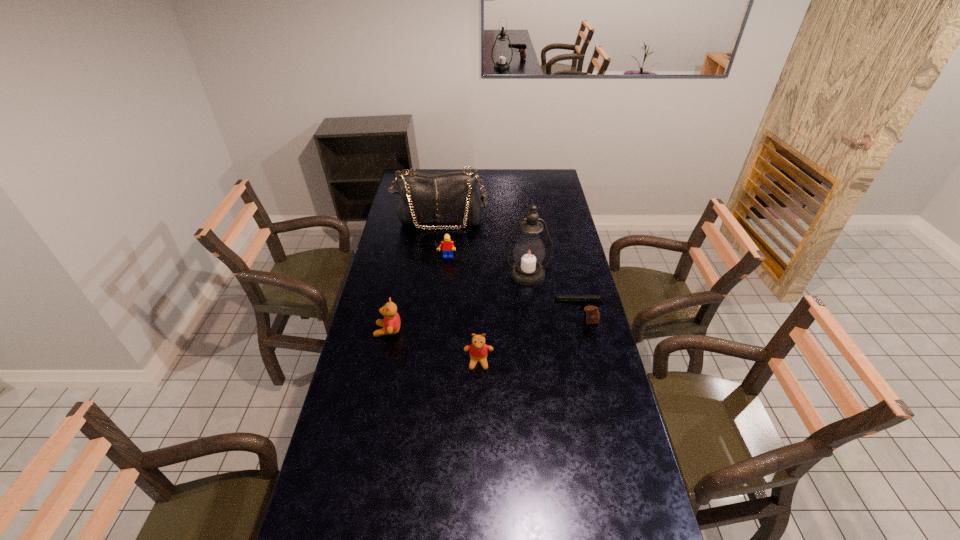
This screenshot has height=540, width=960. I want to click on pistol situated at the right edge, so click(x=590, y=303).

This screenshot has height=540, width=960. What are the coordinates of `blank space at the far edge of the desktop` in the screenshot? It's located at (450, 171).

Locate an element on the screen. This screenshot has width=960, height=540. vacant space at the left edge of the desktop is located at coordinates pyautogui.click(x=344, y=467).

Where is `vacant space at the right edge of the desktop`? The image size is (960, 540). vacant space at the right edge of the desktop is located at coordinates (561, 232).

This screenshot has width=960, height=540. In the image, there is a desktop. In order to click on free space at the near right corner in this screenshot , I will do `click(604, 534)`.

Find the location of a particular element. This screenshot has width=960, height=540. vacant area between the oil lamp and the pistol is located at coordinates (551, 298).

Where is `empty space that is in between the handbag and the fifth nearest object`? Image resolution: width=960 pixels, height=540 pixels. empty space that is in between the handbag and the fifth nearest object is located at coordinates (444, 239).

Locate an element on the screen. This screenshot has height=540, width=960. vacant space that's between the farther teddy bear and the Lego is located at coordinates (418, 294).

Where is `blank region between the nearest object and the tallest object`? Image resolution: width=960 pixels, height=540 pixels. blank region between the nearest object and the tallest object is located at coordinates (503, 318).

The width and height of the screenshot is (960, 540). I want to click on free space between the pistol and the handbag, so click(508, 271).